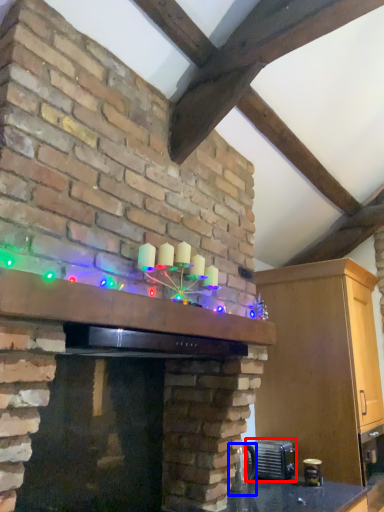
Question: Which object appears farthest to the camera in this image, appliance (highlighted by a red box) or appliance (highlighted by a blue box)?

Choices:
 (A) appliance
 (B) appliance

Answer: (A)